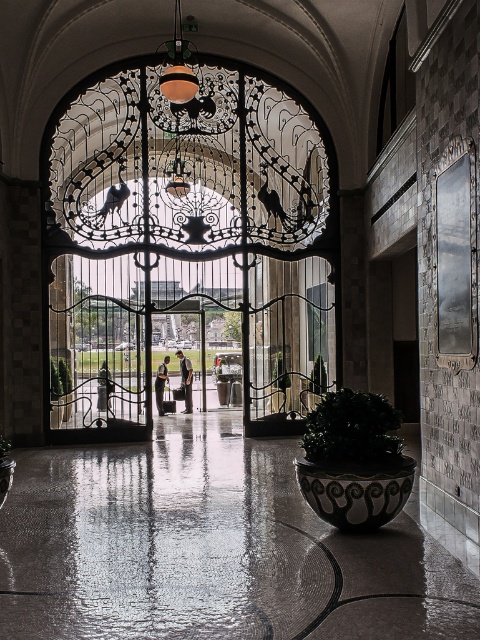
Consider the image. You are a delivery person with a package that needs to be placed on the dark green leafy plant at lower center. The package is 1.5 meters tall. Can you place it on the plant without the package touching the polished metal gate at center?

The polished metal gate at center is much taller than the dark green leafy plant at lower center. Since the gate is taller, placing a 1.5 meter tall package on the plant might cause the package to touch the gate if the gate is over 1.5 meters tall. However, since the gate is only described as being taller than the plant but not the exact height, it is uncertain. Therefore, it is safer to assume that the package might touch the gate if it is placed on the plant.

You are standing at the entrance of the grand building and want to enter. Where exactly is the polished metal gate at center located in terms of coordinates?

The polished metal gate at center is located at point (189, 246).